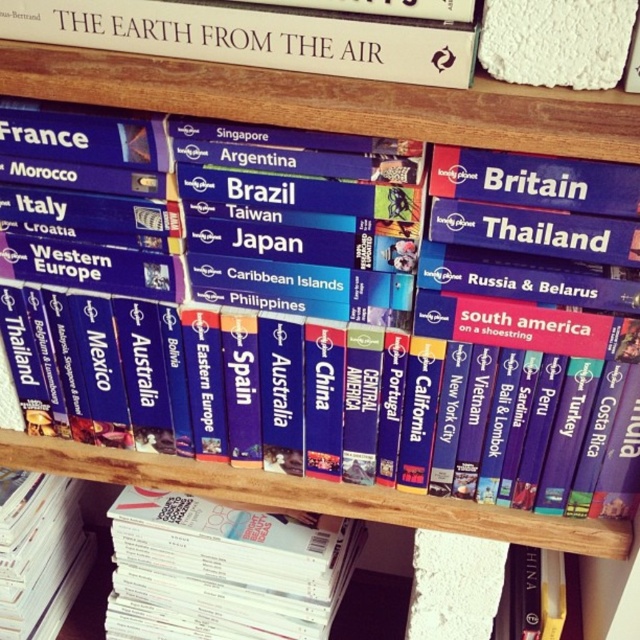
Is point (324, 520) behind point (26, 634)?

No.

Who is taller, white glossy book at lower center or white paper book at lower left?

white paper book at lower left is taller.

Locate an element on the screen. white glossy book at lower center is located at coordinates (224, 570).

Between white glossy book at lower center and white paper book at upper center, which one appears on the right side from the viewer's perspective?

white paper book at upper center

Does white glossy book at lower center have a lesser width compared to white paper book at upper center?

Correct, white glossy book at lower center's width is less than white paper book at upper center's.

This screenshot has width=640, height=640. Describe the element at coordinates (224, 570) in the screenshot. I see `white glossy book at lower center` at that location.

I want to click on white glossy book at lower center, so click(224, 570).

Can you confirm if white paper book at upper center is positioned to the right of white paper book at lower left?

Correct, you'll find white paper book at upper center to the right of white paper book at lower left.

Is point (122, 8) farther from viewer compared to point (1, 490)?

No.

The width and height of the screenshot is (640, 640). I want to click on white paper book at upper center, so coord(253,36).